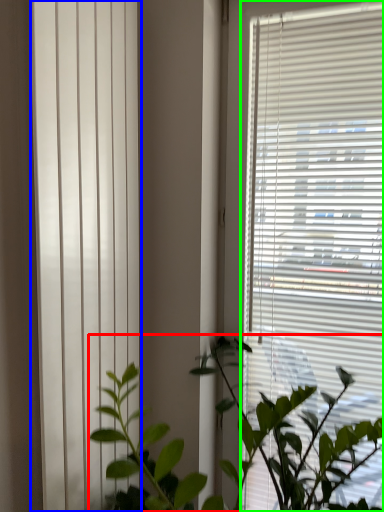
Question: Which is nearer to the houseplant (highlighted by a red box)? shutter (highlighted by a blue box) or window blind (highlighted by a green box).

Choices:
 (A) shutter
 (B) window blind

Answer: (B)